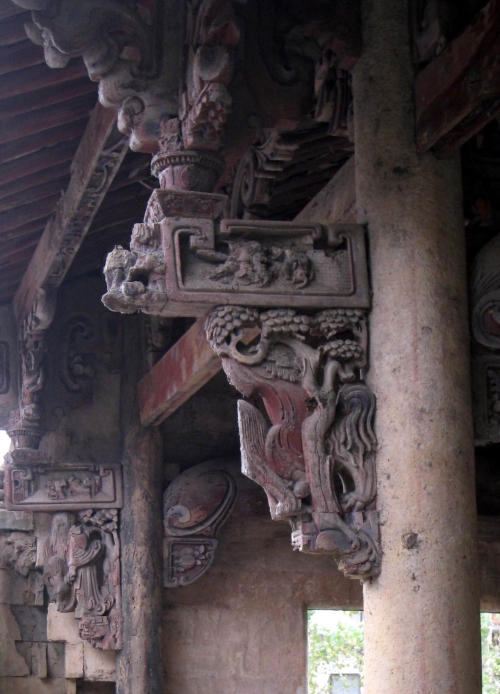
The image size is (500, 694). In order to click on column in this screenshot , I will do `click(423, 550)`.